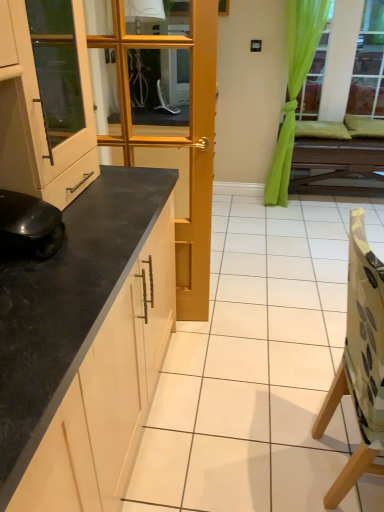
Locate an element on the screen. This screenshot has height=512, width=384. vacant space to the right of matte white cabinet at left is located at coordinates (117, 197).